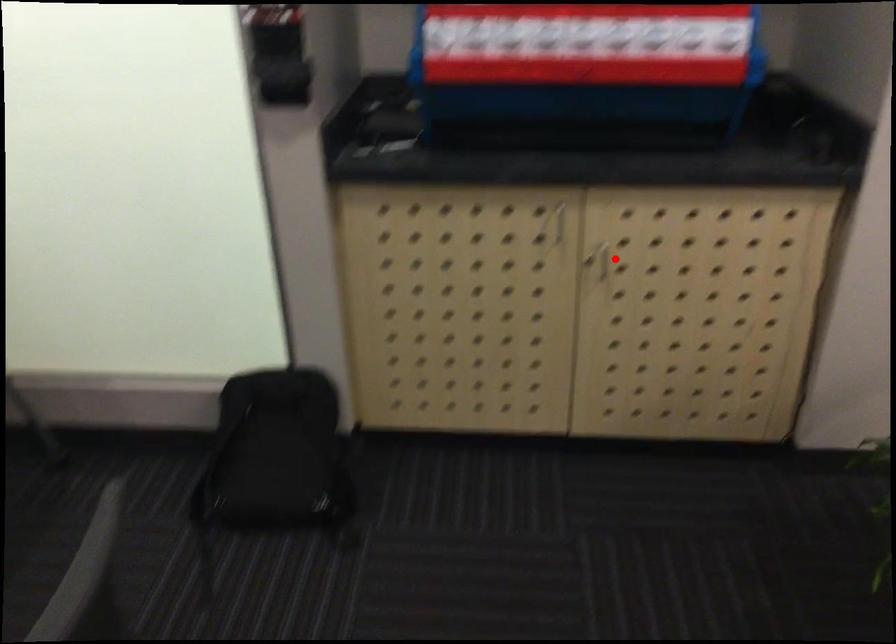
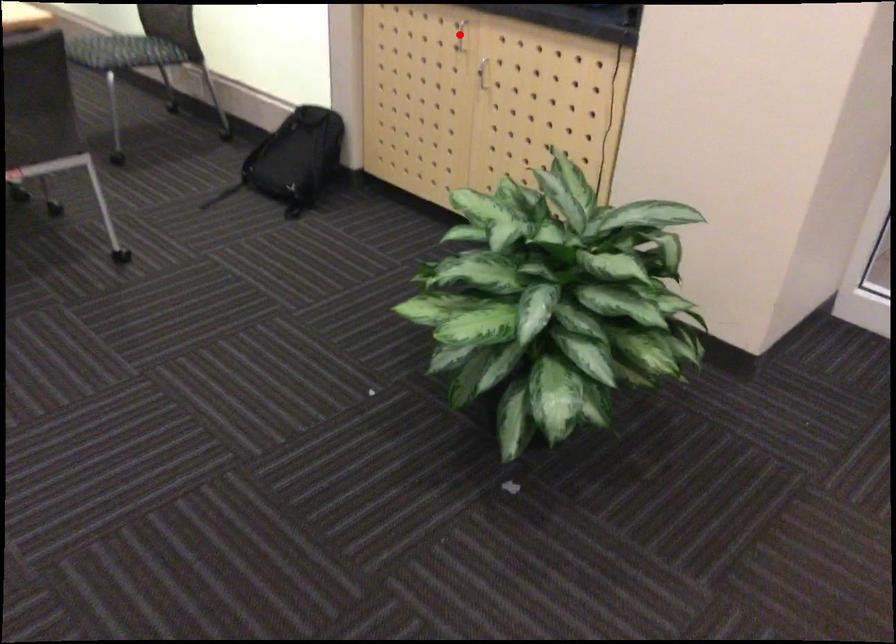
I am providing you with two images of the same scene from different viewpoints. A red point is marked on the first image and another point is marked on the second image. Is the marked point in image1 the same physical position as the marked point in image2?

No